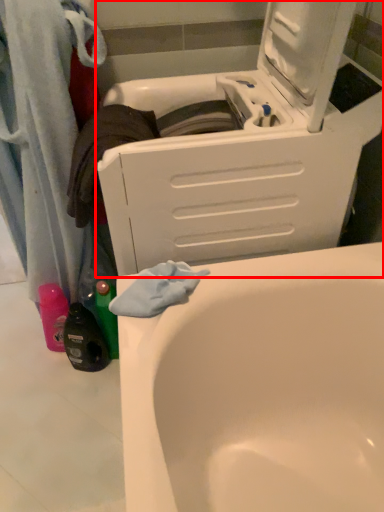
Question: From the image's perspective, where is washing machine (annotated by the red box) located relative to bathtub?

Choices:
 (A) above
 (B) below

Answer: (A)